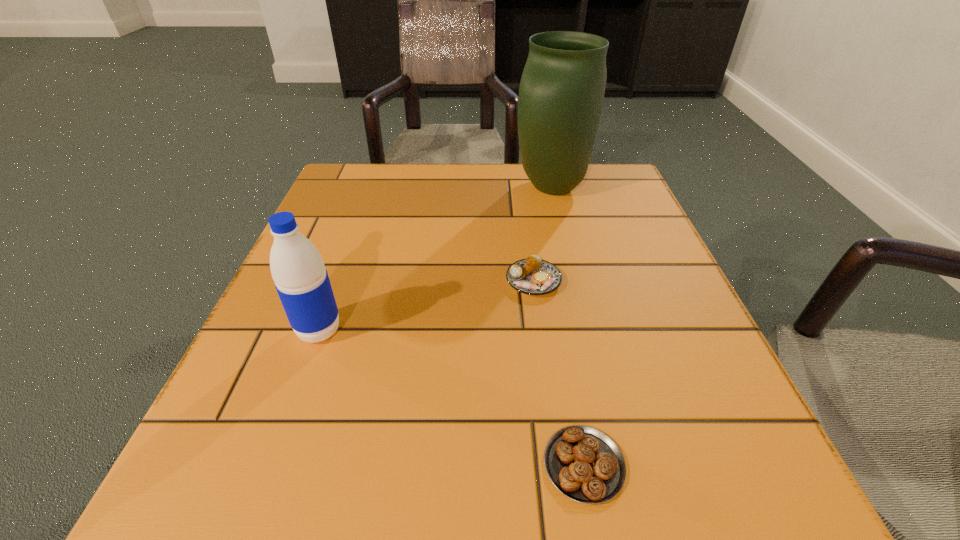
In the image, there is a desktop. Identify the location of free space at the far left corner. (327, 199).

Locate an element on the screen. This screenshot has width=960, height=540. vacant point at the near right corner is located at coordinates (740, 521).

At what (x,y) coordinates should I click in order to perform the action: click on free space between the vase and the water bottle. Please return your answer as a coordinate pair (x, y). Looking at the image, I should click on (436, 259).

Where is `vacant area that lies between the taller pastry and the leftmost object`? The image size is (960, 540). vacant area that lies between the taller pastry and the leftmost object is located at coordinates (426, 306).

The image size is (960, 540). Identify the location of vacant area that lies between the vase and the nearest object. (567, 326).

What are the coordinates of `blank region between the third farthest object and the nearer pastry` in the screenshot? It's located at (451, 397).

Identify the location of free space between the nearest object and the second tallest object. (451, 397).

You are a GUI agent. You are given a task and a screenshot of the screen. Output one action in this format:
    pyautogui.click(x=<x>, y=<y>)
    Task: Click on the unoccupied area between the vase and the second farthest object
    
    Given the screenshot: What is the action you would take?
    point(542,234)

I want to click on vacant area between the third tallest object and the vase, so click(542, 234).

Where is `free space between the leftmost object and the taller pastry`? free space between the leftmost object and the taller pastry is located at coordinates (426, 306).